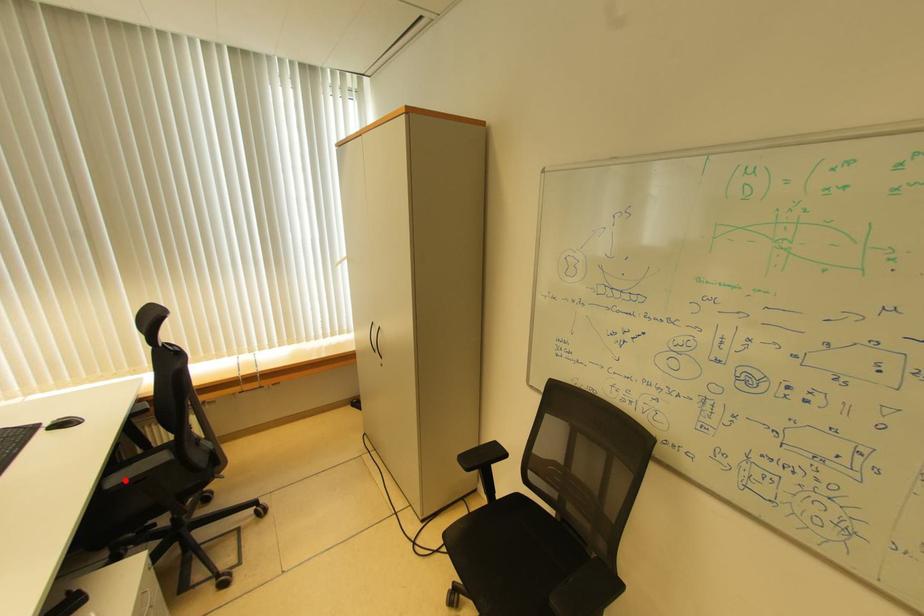
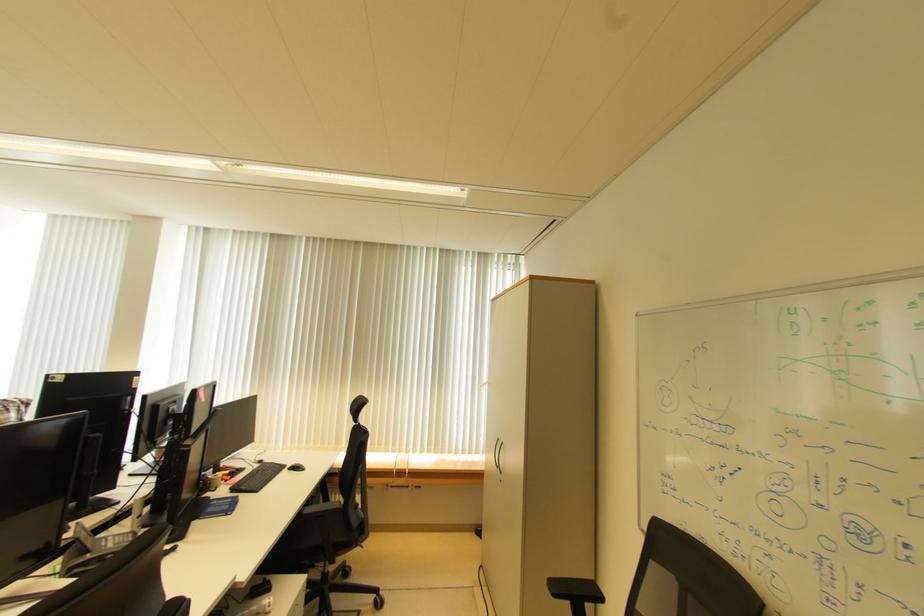
Locate, in the second image, the point that corresponds to the highlighted location in the first image.

(319, 511)